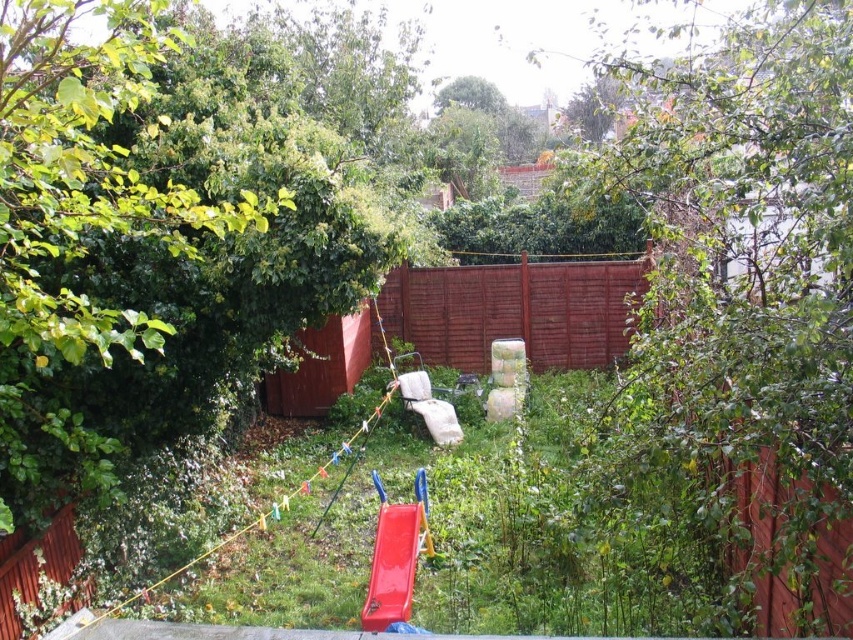
Question: Does green grass at center appear on the right side of brown wooden fence at center?

Choices:
 (A) no
 (B) yes

Answer: (B)

Question: Is brown wooden fence at center bigger than shiny plastic slide at center?

Choices:
 (A) no
 (B) yes

Answer: (B)

Question: Which of the following is the closest to the observer?

Choices:
 (A) (393, 534)
 (B) (549, 560)
 (C) (563, 305)

Answer: (A)

Question: Which object is the farthest from the shiny plastic slide at center?

Choices:
 (A) green grass at center
 (B) brown wooden fence at center

Answer: (B)

Question: Does green grass at center lie behind brown wooden fence at center?

Choices:
 (A) yes
 (B) no

Answer: (B)

Question: Which is farther from the shiny plastic slide at center?

Choices:
 (A) brown wooden fence at center
 (B) green grass at center

Answer: (A)